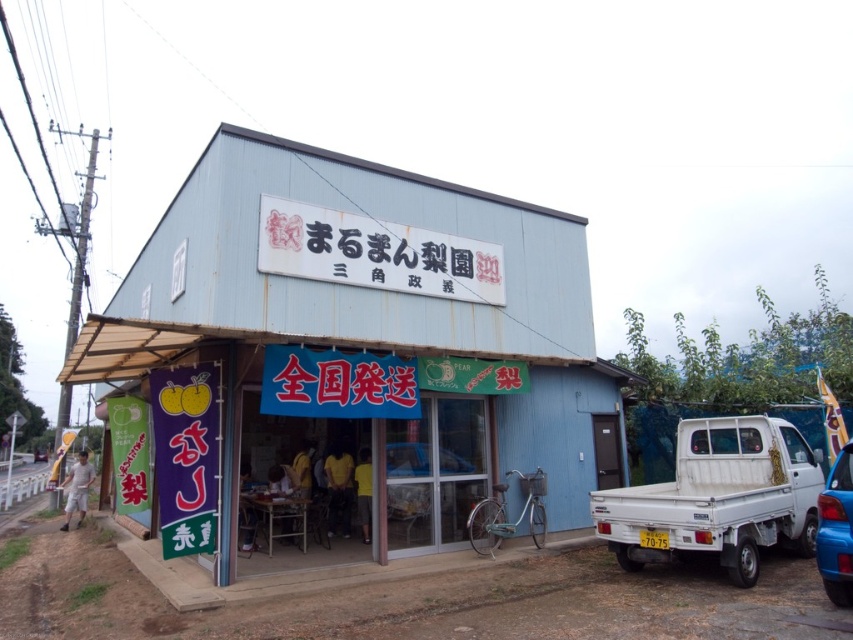
You are a delivery driver who just arrived at the blue corrugated metal hut at center and the white matte truck at right. You need to unload packages from the truck into the hut. Based on the scene, can you physically move the packages from the truck to the hut without needing a ramp or ladder?

The blue corrugated metal hut at center is located above the white matte truck at right, so the height difference between them means you would need a ramp or ladder to move packages from the truck to the hut.

You are a delivery person who needs to park your vehicle in front of the shop. The shop has a loading zone marked for vehicles. If you have a delivery van that is 5 feet wide, can you park it between the white matte truck at right and the blue glossy car at lower right?

The white matte truck at right and blue glossy car at lower right are 5.12 feet apart. Since the delivery van is 5 feet wide, it can fit between them as the space is slightly wider than the van.

You are a delivery person who needs to load a large package into a vehicle. You see the white matte truck at right and the blue glossy car at lower right. Which vehicle can accommodate the large package based on their sizes?

The white matte truck at right is much taller than the blue glossy car at lower right, so the large package can be accommodated in the white matte truck at right.